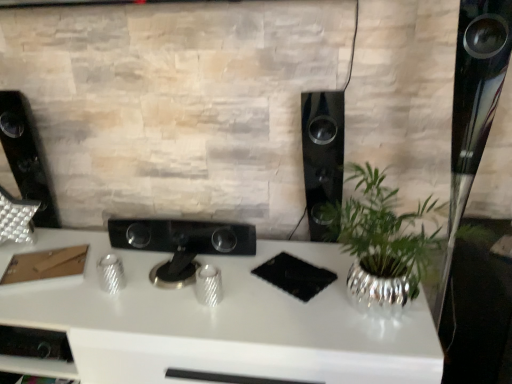
The width and height of the screenshot is (512, 384). Identify the location of free location to the left of black glossy controller at center. (61, 284).